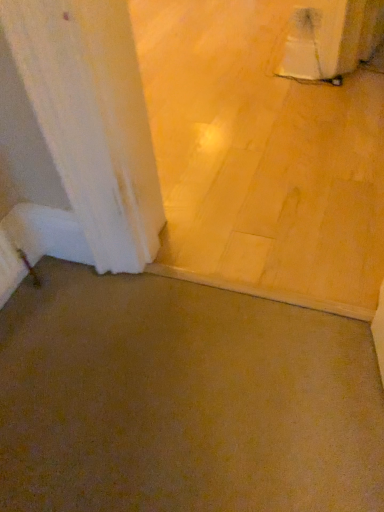
Question: Considering the relative positions of brown matte concrete at lower left, positioned as the 2th concrete in bottom-to-top order, and brown matte concrete at center, placed as the 2th concrete when sorted from back to front, in the image provided, is brown matte concrete at lower left, positioned as the 2th concrete in bottom-to-top order, to the left or to the right of brown matte concrete at center, placed as the 2th concrete when sorted from back to front,?

Choices:
 (A) right
 (B) left

Answer: (A)

Question: Considering the positions of brown matte concrete at lower left, marked as the second concrete in a front-to-back arrangement, and brown matte concrete at center, placed as the 2th concrete when sorted from back to front, in the image, is brown matte concrete at lower left, marked as the second concrete in a front-to-back arrangement, wider or thinner than brown matte concrete at center, placed as the 2th concrete when sorted from back to front,?

Choices:
 (A) wide
 (B) thin

Answer: (A)

Question: Choose the correct answer: Is brown matte concrete at lower left, positioned as the 1th concrete in back-to-front order, inside brown matte concrete at center, which ranks as the 2th concrete in top-to-bottom order, or outside it?

Choices:
 (A) outside
 (B) inside

Answer: (A)

Question: Considering their positions, is brown matte concrete at center, the 1th concrete from the front, located in front of or behind brown matte concrete at lower left, marked as the second concrete in a front-to-back arrangement?

Choices:
 (A) front
 (B) behind

Answer: (A)

Question: Does point (54, 464) appear closer or farther from the camera than point (208, 10)?

Choices:
 (A) farther
 (B) closer

Answer: (B)

Question: In terms of width, does brown matte concrete at center, placed as the 2th concrete when sorted from back to front, look wider or thinner when compared to brown matte concrete at lower left, which appears as the 1th concrete when viewed from the top?

Choices:
 (A) wide
 (B) thin

Answer: (B)

Question: Based on their sizes in the image, would you say brown matte concrete at center, placed as the 2th concrete when sorted from back to front, is bigger or smaller than brown matte concrete at lower left, positioned as the 2th concrete in bottom-to-top order?

Choices:
 (A) big
 (B) small

Answer: (B)